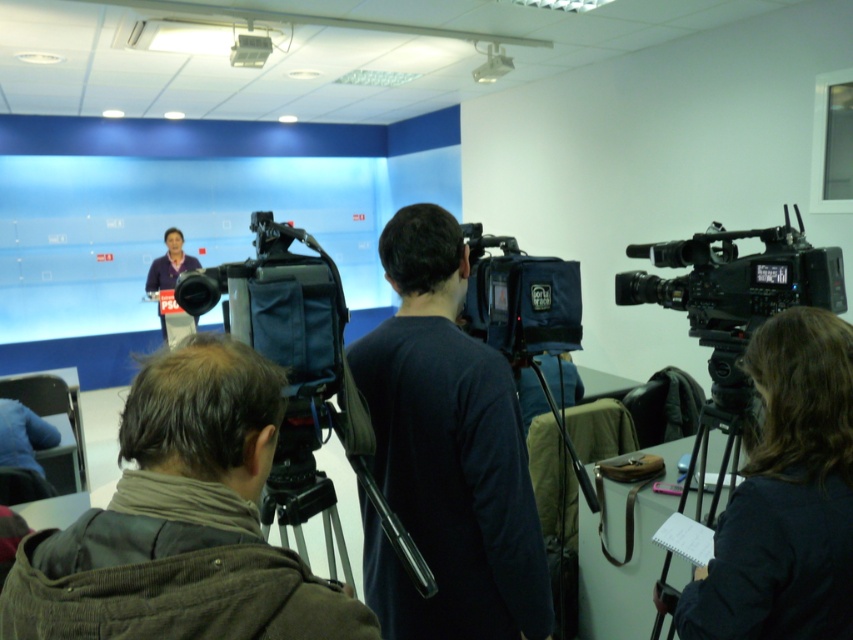
Question: Which object is the farthest from the black plastic tripod at lower right?

Choices:
 (A) black matte video camera at center
 (B) matte purple shirt at center

Answer: (B)

Question: Can you confirm if brown woolen scarf at lower left is positioned to the left of matte purple shirt at center?

Choices:
 (A) yes
 (B) no

Answer: (B)

Question: Estimate the real-world distances between objects in this image. Which object is closer to the dark blue fabric at center?

Choices:
 (A) matte purple shirt at center
 (B) brown woolen scarf at lower left
 (C) white plastic projector at upper center

Answer: (B)

Question: Does black matte video camera at center have a greater width compared to black plastic tripod at lower right?

Choices:
 (A) no
 (B) yes

Answer: (B)

Question: Among these objects, which one is farthest from the camera?

Choices:
 (A) black matte video camera at center
 (B) black matte camera at center
 (C) dark blue fabric at center
 (D) white plastic projector at upper center

Answer: (D)

Question: Is black matte video camera at center to the left of black matte camera at center from the viewer's perspective?

Choices:
 (A) no
 (B) yes

Answer: (B)